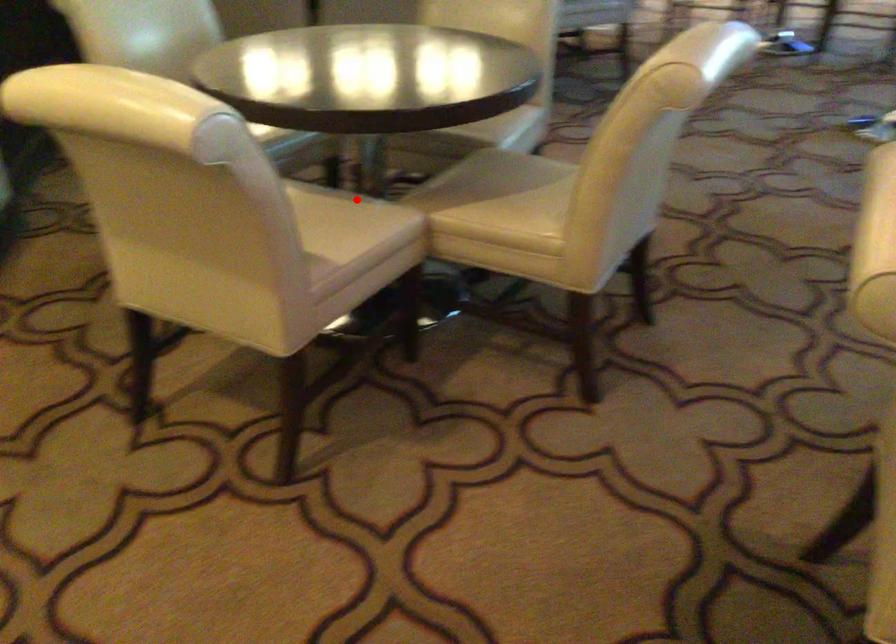
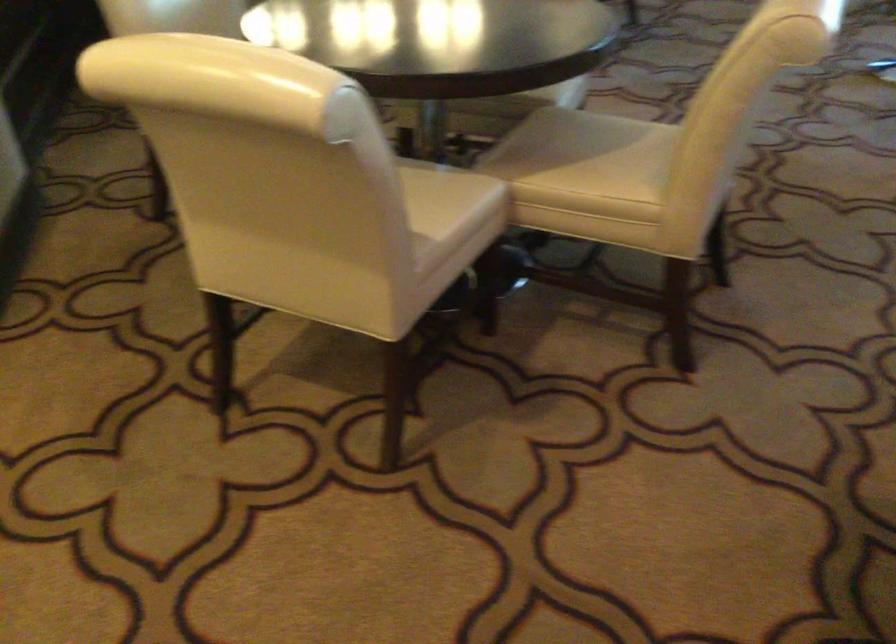
In the second image, find the point that corresponds to the highlighted location in the first image.

(437, 167)